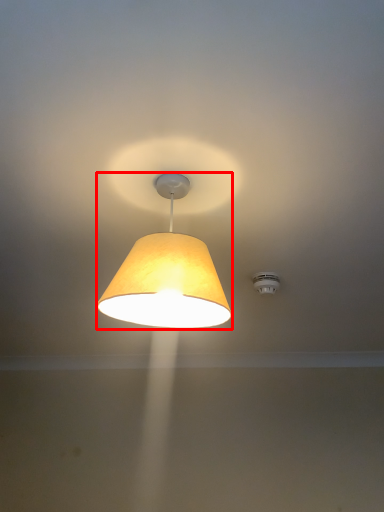
Question: From the image's perspective, what is the correct spatial positioning of lamp (annotated by the red box) in reference to lighting?

Choices:
 (A) below
 (B) above

Answer: (B)